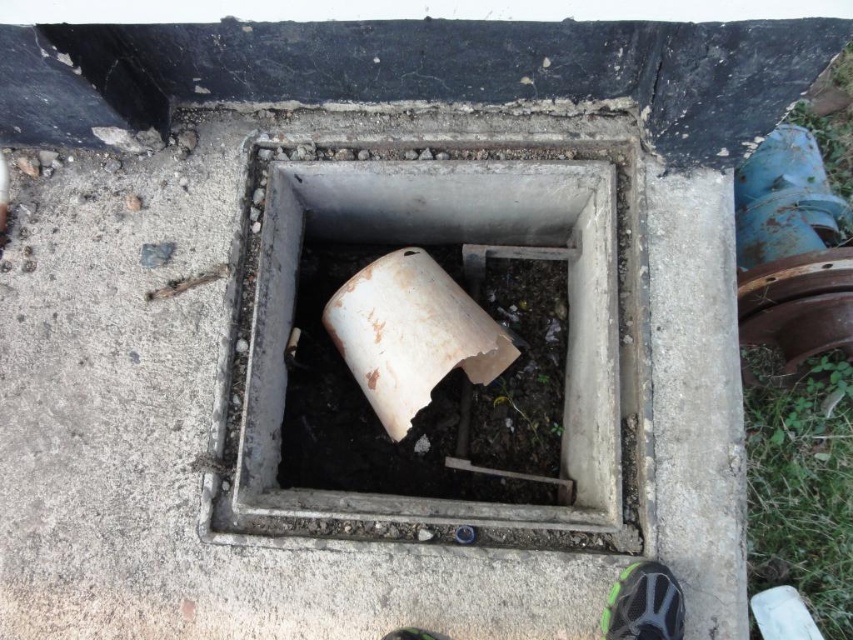
You are standing at the edge of the square concrete opening and want to move from point A to point B. Point A is at coordinate point (x=241, y=369) and point B is at coordinate point (x=426, y=637). Which point is closer to you when you are facing the opening?

Point A at coordinate point (x=241, y=369) is closer to you since it is further to the viewer than point B at coordinate point (x=426, y=637), meaning it is nearer in the scene.

You are a worker inspecting the manhole opening. You notice two green shoes near the opening. Which shoe is taller, the green fabric shoe at lower right or the green matte shoe at lower center?

The green fabric shoe at lower right is taller than the green matte shoe at lower center.

You are a construction worker assessing the manhole opening. You have a white matte pipe at center that needs to be placed into the white matte cement at center. Based on their sizes, will the pipe fit inside the cement?

The white matte cement at center might be wider than the white matte pipe at center, so there is a possibility that the pipe could fit inside the cement. However, since the exact dimensions are uncertain, further measurements should be taken to confirm.